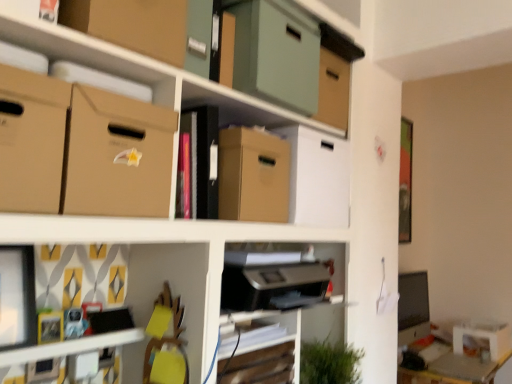
What do you see at coordinates (74, 323) in the screenshot? The width and height of the screenshot is (512, 384). I see `matte plastic toy at lower left` at bounding box center [74, 323].

What do you see at coordinates (111, 161) in the screenshot? I see `matte cardboard boxes at upper center` at bounding box center [111, 161].

Identify the location of matte brown cardboard box at left, placed as the 3th cardboard box when sorted from top to bottom. This screenshot has width=512, height=384. (31, 140).

What do you see at coordinates (454, 370) in the screenshot?
I see `wooden table at lower right` at bounding box center [454, 370].

Locate an element on the screen. matte brown cardboard box at upper left, arranged as the 5th cardboard box when ordered from the bottom is located at coordinates (132, 25).

Find the location of a particular element. This screenshot has height=384, width=512. matte plastic toy at lower left is located at coordinates (74, 323).

Identify the location of the 1st cardboard box below the matte green cardboard box at upper center, the second cardboard box from the top (from the image's perspective). The height and width of the screenshot is (384, 512). (31, 140).

Does point (284, 25) come closer to viewer compared to point (20, 168)?

No, it is behind (20, 168).

From the image's perspective, relative to matte brown cardboard box at left, placed as the third cardboard box when sorted from bottom to top, is matte green cardboard box at upper center, positioned as the fourth cardboard box in bottom-to-top order, above or below?

Based on their image positions, matte green cardboard box at upper center, positioned as the fourth cardboard box in bottom-to-top order, is located above matte brown cardboard box at left, placed as the third cardboard box when sorted from bottom to top.

Can you confirm if matte green cardboard box at upper center, the second cardboard box from the top, is smaller than matte brown cardboard box at left, placed as the 3th cardboard box when sorted from top to bottom?

No, matte green cardboard box at upper center, the second cardboard box from the top, is not smaller than matte brown cardboard box at left, placed as the 3th cardboard box when sorted from top to bottom.

Considering the relative positions of matte brown cardboard box at upper left, arranged as the 5th cardboard box when ordered from the bottom, and matte cardboard box at center, positioned as the second storage box in back-to-front order, in the image provided, is matte brown cardboard box at upper left, arranged as the 5th cardboard box when ordered from the bottom, in front of matte cardboard box at center, positioned as the second storage box in back-to-front order,?

Yes, matte brown cardboard box at upper left, arranged as the 5th cardboard box when ordered from the bottom, is closer to the viewer.

Can you tell me how much matte brown cardboard box at upper left, the first cardboard box in the top-to-bottom sequence, and matte cardboard box at center, positioned as the second storage box in back-to-front order, differ in facing direction?

matte brown cardboard box at upper left, the first cardboard box in the top-to-bottom sequence, and matte cardboard box at center, positioned as the second storage box in back-to-front order, are facing 8.72e-05 degrees away from each other.

Considering the sizes of matte brown cardboard box at upper left, the first cardboard box in the top-to-bottom sequence, and matte cardboard box at center, which ranks as the first storage box in top-to-bottom order, in the image, is matte brown cardboard box at upper left, the first cardboard box in the top-to-bottom sequence, bigger or smaller than matte cardboard box at center, which ranks as the first storage box in top-to-bottom order,?

In the image, matte brown cardboard box at upper left, the first cardboard box in the top-to-bottom sequence, appears to be smaller than matte cardboard box at center, which ranks as the first storage box in top-to-bottom order.

Are matte cardboard boxes at upper center and matte brown cardboard box at upper left, arranged as the 5th cardboard box when ordered from the bottom, beside each other?

matte cardboard boxes at upper center and matte brown cardboard box at upper left, arranged as the 5th cardboard box when ordered from the bottom, are not in contact.

Based on the photo, is matte cardboard boxes at upper center further to camera compared to matte brown cardboard box at upper left, arranged as the 5th cardboard box when ordered from the bottom?

That is False.

Between matte cardboard boxes at upper center and matte brown cardboard box at upper left, the first cardboard box in the top-to-bottom sequence, which one appears on the right side from the viewer's perspective?

matte cardboard boxes at upper center.

From a real-world perspective, is matte cardboard boxes at upper center located higher than matte brown cardboard box at upper left, the first cardboard box in the top-to-bottom sequence?

Actually, matte cardboard boxes at upper center is physically below matte brown cardboard box at upper left, the first cardboard box in the top-to-bottom sequence, in the real world.

Considering the sizes of matte brown cardboard box at upper left, arranged as the 5th cardboard box when ordered from the bottom, and wooden table at lower right in the image, is matte brown cardboard box at upper left, arranged as the 5th cardboard box when ordered from the bottom, bigger or smaller than wooden table at lower right?

Considering their sizes, matte brown cardboard box at upper left, arranged as the 5th cardboard box when ordered from the bottom, takes up less space than wooden table at lower right.

Is matte brown cardboard box at upper left, arranged as the 5th cardboard box when ordered from the bottom, wider than wooden table at lower right?

No.

Is matte brown cardboard box at upper left, arranged as the 5th cardboard box when ordered from the bottom, inside or outside of wooden table at lower right?

The correct answer is: outside.

From the image's perspective, which one is positioned higher, matte brown cardboard box at upper left, the first cardboard box in the top-to-bottom sequence, or wooden table at lower right?

matte brown cardboard box at upper left, the first cardboard box in the top-to-bottom sequence, appears higher in the image.

Is wooden table at lower right next to matte cardboard boxes at upper center?

No, wooden table at lower right is not in contact with matte cardboard boxes at upper center.

Is wooden table at lower right located outside matte cardboard boxes at upper center?

Yes, wooden table at lower right is outside of matte cardboard boxes at upper center.

From a real-world perspective, is wooden table at lower right on top of matte cardboard boxes at upper center?

Incorrect, from a real-world perspective, wooden table at lower right is lower than matte cardboard boxes at upper center.

Considering the sizes of objects matte plastic toy at lower left and wooden swivel chair at lower center in the image provided, who is smaller, matte plastic toy at lower left or wooden swivel chair at lower center?

Smaller between the two is matte plastic toy at lower left.

Who is more distant, matte plastic toy at lower left or wooden swivel chair at lower center?

matte plastic toy at lower left is further from the camera.

Is matte plastic toy at lower left wider than wooden swivel chair at lower center?

Yes.

How many degrees apart are the facing directions of matte plastic toy at lower left and wooden swivel chair at lower center?

79.4 degrees separate the facing orientations of matte plastic toy at lower left and wooden swivel chair at lower center.

Considering the relative positions of matte cardboard boxes at upper center and matte brown cardboard box at left, placed as the 3th cardboard box when sorted from top to bottom, in the image provided, is matte cardboard boxes at upper center to the left of matte brown cardboard box at left, placed as the 3th cardboard box when sorted from top to bottom, from the viewer's perspective?

No.

Is point (42, 145) closer to viewer compared to point (6, 182)?

No, (42, 145) is behind (6, 182).

How distant is matte cardboard boxes at upper center from matte brown cardboard box at left, placed as the third cardboard box when sorted from bottom to top?

matte cardboard boxes at upper center and matte brown cardboard box at left, placed as the third cardboard box when sorted from bottom to top, are 10.42 inches apart.

Relative to matte brown cardboard box at left, placed as the third cardboard box when sorted from bottom to top, is matte cardboard boxes at upper center in front or behind?

Clearly, matte cardboard boxes at upper center is in front of matte brown cardboard box at left, placed as the third cardboard box when sorted from bottom to top.

From the image's perspective, count 1st cardboard boxs downward from the matte green cardboard box at upper center, the second cardboard box from the top, and point to it. Please provide its 2D coordinates.

[(31, 140)]

I want to click on cardboard box that is the 3rd object located in front of the matte cardboard box at center, arranged as the 2th storage box when viewed from the right, so click(x=132, y=25).

Estimate the real-world distances between objects in this image. Which object is closer to matte cardboard box at center, which ranks as the first storage box in top-to-bottom order, wooden table at lower right or brown cardboard box at center, which is counted as the 5th cardboard box, starting from the top?

brown cardboard box at center, which is counted as the 5th cardboard box, starting from the top, lies closer to matte cardboard box at center, which ranks as the first storage box in top-to-bottom order, than the other object.

Considering their positions, is matte cardboard box at center, which ranks as the first storage box in top-to-bottom order, positioned further to wooden table at lower right than matte brown cardboard box at left, placed as the third cardboard box when sorted from bottom to top?

Among the two, matte brown cardboard box at left, placed as the third cardboard box when sorted from bottom to top, is located further to wooden table at lower right.

In the scene shown: Looking at the image, which one is located closer to brown cardboard box at upper left, which is counted as the 4th cardboard box, starting from the top, wooden swivel chair at lower center or matte cardboard box at center, which ranks as the first storage box in top-to-bottom order?

The object closer to brown cardboard box at upper left, which is counted as the 4th cardboard box, starting from the top, is wooden swivel chair at lower center.

Estimate the real-world distances between objects in this image. Which object is further from wooden swivel chair at lower center, brown cardboard box at center, which is counted as the 5th cardboard box, starting from the top, or matte plastic toy at lower left?

brown cardboard box at center, which is counted as the 5th cardboard box, starting from the top, lies further to wooden swivel chair at lower center than the other object.

When comparing their distances from matte cardboard box at center, the 2th storage box positioned from the bottom, does wooden table at lower right or matte brown cardboard box at left, placed as the 3th cardboard box when sorted from top to bottom, seem closer?

Among the two, matte brown cardboard box at left, placed as the 3th cardboard box when sorted from top to bottom, is located nearer to matte cardboard box at center, the 2th storage box positioned from the bottom.

Looking at the image, which one is located further to matte brown cardboard box at upper left, arranged as the 5th cardboard box when ordered from the bottom, brown cardboard box at center, positioned as the 1th cardboard box in bottom-to-top order, or matte cardboard boxes at upper center?

Based on the image, brown cardboard box at center, positioned as the 1th cardboard box in bottom-to-top order, appears to be further to matte brown cardboard box at upper left, arranged as the 5th cardboard box when ordered from the bottom.

Estimate the real-world distances between objects in this image. Which object is closer to matte brown cardboard box at upper left, the first cardboard box in the top-to-bottom sequence, brown cardboard box at upper left, acting as the 2th cardboard box starting from the bottom, or wooden swivel chair at lower center?

Based on the image, brown cardboard box at upper left, acting as the 2th cardboard box starting from the bottom, appears to be nearer to matte brown cardboard box at upper left, the first cardboard box in the top-to-bottom sequence.

Which object lies nearer to the anchor point matte brown cardboard box at left, placed as the third cardboard box when sorted from bottom to top, brown cardboard box at upper left, which is counted as the 4th cardboard box, starting from the top, or wooden swivel chair at lower center?

brown cardboard box at upper left, which is counted as the 4th cardboard box, starting from the top, is closer to matte brown cardboard box at left, placed as the third cardboard box when sorted from bottom to top.

This screenshot has height=384, width=512. Find the location of `storage box between matte plastic toy at lower left and wooden table at lower right from left to right`. storage box between matte plastic toy at lower left and wooden table at lower right from left to right is located at coordinates (317, 178).

Where is `toy between matte brown cardboard box at left, placed as the 3th cardboard box when sorted from top to bottom, and matte cardboard box at center, the 2th storage box positioned from the bottom`? Image resolution: width=512 pixels, height=384 pixels. toy between matte brown cardboard box at left, placed as the 3th cardboard box when sorted from top to bottom, and matte cardboard box at center, the 2th storage box positioned from the bottom is located at coordinates (74, 323).

Find the location of `storage box between brown cardboard box at center, positioned as the 1th cardboard box in bottom-to-top order, and white cardboard box at lower right, the second storage box viewed from the left, from left to right`. storage box between brown cardboard box at center, positioned as the 1th cardboard box in bottom-to-top order, and white cardboard box at lower right, the second storage box viewed from the left, from left to right is located at coordinates (317, 178).

You are a GUI agent. You are given a task and a screenshot of the screen. Output one action in this format:
    pyautogui.click(x=<x>, y=<y>)
    Task: Click on the shelf between matte brown cardboard box at upper left, arranged as the 5th cardboard box when ordered from the bottom, and wooden swivel chair at lower center in the up-down direction
    The width and height of the screenshot is (512, 384).
    Given the screenshot: What is the action you would take?
    pyautogui.click(x=111, y=161)